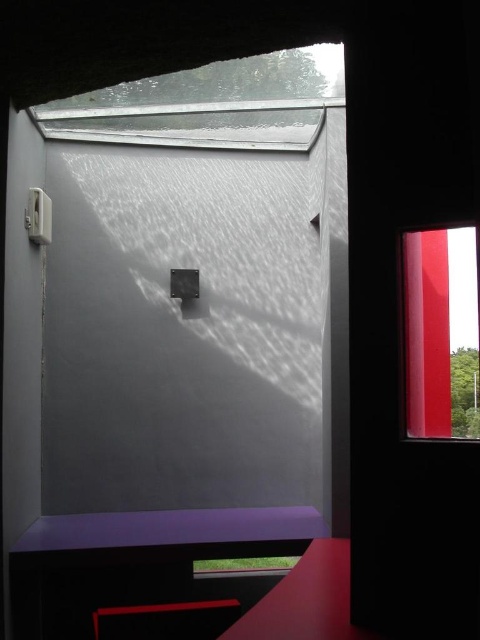
Can you confirm if purple matte table at lower center is positioned below transparent glass window at right?

Indeed, purple matte table at lower center is positioned under transparent glass window at right.

Looking at this image, does purple matte table at lower center have a lesser width compared to transparent glass window at right?

In fact, purple matte table at lower center might be wider than transparent glass window at right.

This screenshot has height=640, width=480. Identify the location of purple matte table at lower center. (135, 557).

Can you confirm if purple matte table at lower center is taller than matte purple stool at lower center?

Yes.

Between purple matte table at lower center and matte purple stool at lower center, which one appears on the right side from the viewer's perspective?

matte purple stool at lower center

Is point (75, 570) more distant than point (146, 637)?

Yes, it is.

Identify the location of purple matte table at lower center. This screenshot has height=640, width=480. (135, 557).

Does transparent glass window at right appear on the left side of matte purple stool at lower center?

Incorrect, transparent glass window at right is not on the left side of matte purple stool at lower center.

Where is `transparent glass window at right`? This screenshot has width=480, height=640. transparent glass window at right is located at coordinates (442, 333).

Between point (476, 314) and point (212, 621), which one is positioned behind?

The point (212, 621) is more distant.

The height and width of the screenshot is (640, 480). What are the coordinates of `transparent glass window at right` in the screenshot? It's located at (442, 333).